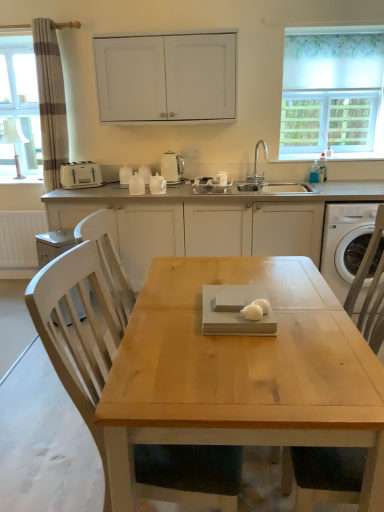
The width and height of the screenshot is (384, 512). Describe the element at coordinates (207, 220) in the screenshot. I see `white matte cabinetry at center, which ranks as the 2th cabinetry in top-to-bottom order` at that location.

What is the approximate width of beige striped curtain at left?

beige striped curtain at left is 7.57 inches in width.

Measure the distance between white matte cabinet at upper center, which is the 1th cabinetry in top-to-bottom order, and camera.

They are 9.64 feet apart.

The image size is (384, 512). What are the coordinates of `white plastic washing machine at right` in the screenshot? It's located at (345, 243).

Could white plastic dishwasher at lower left be considered to be inside silver metallic faucet at sink right?

No, white plastic dishwasher at lower left is not surrounded by silver metallic faucet at sink right.

Is silver metallic faucet at sink right oriented towards white plastic dishwasher at lower left?

No, silver metallic faucet at sink right does not turn towards white plastic dishwasher at lower left.

Which point is more forward, (254, 163) or (63, 231)?

The point (63, 231) is closer to the camera.

Is silver metallic faucet at sink right taller or shorter than white plastic dishwasher at lower left?

Considering their sizes, silver metallic faucet at sink right has less height than white plastic dishwasher at lower left.

Between white plastic washing machine at right and silver metallic faucet at sink right, which one appears on the right side from the viewer's perspective?

Positioned to the right is white plastic washing machine at right.

Is white plastic washing machine at right inside or outside of silver metallic faucet at sink right?

white plastic washing machine at right is located beyond the bounds of silver metallic faucet at sink right.

Is white plastic washing machine at right beside silver metallic faucet at sink right?

No, white plastic washing machine at right is not beside silver metallic faucet at sink right.

Considering the relative sizes of white plastic washing machine at right and silver metallic faucet at sink right in the image provided, is white plastic washing machine at right wider than silver metallic faucet at sink right?

Indeed, white plastic washing machine at right has a greater width compared to silver metallic faucet at sink right.

How much distance is there between white plastic dishwasher at lower left and white plastic toaster at left?

white plastic dishwasher at lower left is 19.92 inches away from white plastic toaster at left.

Considering the sizes of objects white plastic dishwasher at lower left and white plastic toaster at left in the image provided, who is smaller, white plastic dishwasher at lower left or white plastic toaster at left?

white plastic toaster at left is smaller.

Can you tell me how much white plastic dishwasher at lower left and white plastic toaster at left differ in facing direction?

There is a 61-degree angle between the facing directions of white plastic dishwasher at lower left and white plastic toaster at left.

From a real-world perspective, which is physically above, white plastic dishwasher at lower left or white plastic toaster at left?

white plastic toaster at left, from a real-world perspective.

Identify the location of radiator that is under the beige striped curtain at left (from a real-world perspective). (20, 238).

How many degrees apart are the facing directions of beige striped curtain at left and white textured radiator at lower left?

beige striped curtain at left and white textured radiator at lower left are facing 0.352 degrees away from each other.

How distant is beige striped curtain at left from white textured radiator at lower left?

A distance of 33.13 inches exists between beige striped curtain at left and white textured radiator at lower left.

Is beige striped curtain at left located outside white textured radiator at lower left?

Yes, beige striped curtain at left is located beyond the bounds of white textured radiator at lower left.

Is white plastic toaster at left bigger than white plastic washing machine at right?

Actually, white plastic toaster at left might be smaller than white plastic washing machine at right.

Relative to white plastic washing machine at right, is white plastic toaster at left in front or behind?

white plastic toaster at left is behind white plastic washing machine at right.

From the image's perspective, is white matte cabinetry at center, which ranks as the 2th cabinetry in top-to-bottom order, located above or below white fabric at upper right?

Based on their image positions, white matte cabinetry at center, which ranks as the 2th cabinetry in top-to-bottom order, is located beneath white fabric at upper right.

Considering the relative sizes of white matte cabinetry at center, placed as the 1th cabinetry when sorted from bottom to top, and white fabric at upper right in the image provided, is white matte cabinetry at center, placed as the 1th cabinetry when sorted from bottom to top, smaller than white fabric at upper right?

Actually, white matte cabinetry at center, placed as the 1th cabinetry when sorted from bottom to top, might be larger than white fabric at upper right.

Can you tell me how much white matte cabinetry at center, placed as the 1th cabinetry when sorted from bottom to top, and white fabric at upper right differ in facing direction?

The facing directions of white matte cabinetry at center, placed as the 1th cabinetry when sorted from bottom to top, and white fabric at upper right are 0.224 degrees apart.

Is white matte cabinetry at center, which ranks as the 2th cabinetry in top-to-bottom order, aimed at white fabric at upper right?

No, white matte cabinetry at center, which ranks as the 2th cabinetry in top-to-bottom order, is not oriented towards white fabric at upper right.

Are white matte cabinetry at center, placed as the 1th cabinetry when sorted from bottom to top, and beige striped curtain at left beside each other?

There is a gap between white matte cabinetry at center, placed as the 1th cabinetry when sorted from bottom to top, and beige striped curtain at left.

Can you confirm if white matte cabinetry at center, placed as the 1th cabinetry when sorted from bottom to top, is taller than beige striped curtain at left?

In fact, white matte cabinetry at center, placed as the 1th cabinetry when sorted from bottom to top, may be shorter than beige striped curtain at left.

From the image's perspective, which object appears higher, white matte cabinetry at center, which ranks as the 2th cabinetry in top-to-bottom order, or beige striped curtain at left?

beige striped curtain at left, from the image's perspective.

Is white matte cabinetry at center, placed as the 1th cabinetry when sorted from bottom to top, positioned with its back to beige striped curtain at left?

No.

In order to click on dish washer below the silver metallic faucet at sink right (from the image's perspective) in this screenshot , I will do click(53, 245).

Locate an element on the screen. washing machine lying in front of the silver metallic faucet at sink right is located at coordinates point(345,243).

When comparing their distances from white matte cabinetry at center, which ranks as the 2th cabinetry in top-to-bottom order, does beige striped curtain at left or white matte cabinet at upper center, the 2th cabinetry from the bottom, seem further?

beige striped curtain at left is positioned further to the anchor white matte cabinetry at center, which ranks as the 2th cabinetry in top-to-bottom order.

From the image, which object appears to be nearer to white glossy electric kettle at center, white fabric at upper right or light wood chair at center?

Based on the image, white fabric at upper right appears to be nearer to white glossy electric kettle at center.

Looking at the image, which one is located closer to white fabric at upper right, light wood chair at center or white matte cabinetry at center, which ranks as the 2th cabinetry in top-to-bottom order?

Among the two, white matte cabinetry at center, which ranks as the 2th cabinetry in top-to-bottom order, is located nearer to white fabric at upper right.

Looking at the image, which one is located closer to white matte cabinetry at center, placed as the 1th cabinetry when sorted from bottom to top, white plastic dishwasher at lower left or white fabric at upper right?

The object closer to white matte cabinetry at center, placed as the 1th cabinetry when sorted from bottom to top, is white plastic dishwasher at lower left.

Looking at the image, which one is located further to white matte cabinet at upper center, the 2th cabinetry from the bottom, white plastic washing machine at right or white textured radiator at lower left?

white textured radiator at lower left.

Looking at the image, which one is located closer to beige striped curtain at left, white plastic toaster at left or white matte cabinetry at center, placed as the 1th cabinetry when sorted from bottom to top?

Among the two, white plastic toaster at left is located nearer to beige striped curtain at left.

Based on their spatial positions, is white textured radiator at lower left or white glossy electric kettle at center further from beige striped curtain at left?

white glossy electric kettle at center is further to beige striped curtain at left.

Looking at this image, from the image, which object appears to be farther from white fabric at upper right, beige striped curtain at left or white plastic toaster at left?

Based on the image, beige striped curtain at left appears to be further to white fabric at upper right.

The width and height of the screenshot is (384, 512). What are the coordinates of `coffee machine between white plastic toaster at left and silver metallic faucet at sink right in the horizontal direction` in the screenshot? It's located at (172, 167).

Find the location of a particular element. window between white plastic dishwasher at lower left and white plastic washing machine at right from left to right is located at coordinates (333, 92).

Where is `curtain between white textured radiator at lower left and white matte cabinetry at center, placed as the 1th cabinetry when sorted from bottom to top, from left to right`? curtain between white textured radiator at lower left and white matte cabinetry at center, placed as the 1th cabinetry when sorted from bottom to top, from left to right is located at coordinates (50, 101).

Locate an element on the screen. dish washer located between light wood chair at center and beige striped curtain at left in the depth direction is located at coordinates (53, 245).